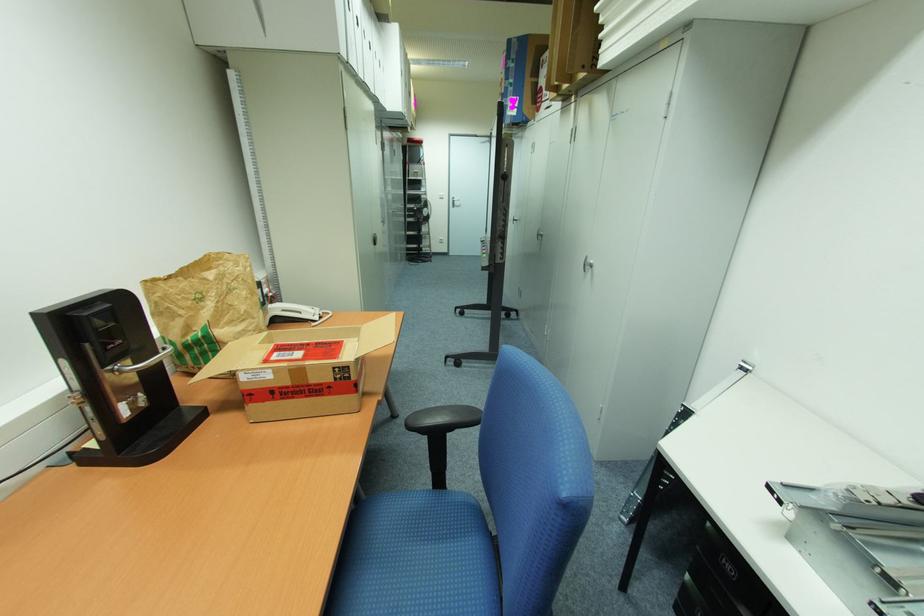
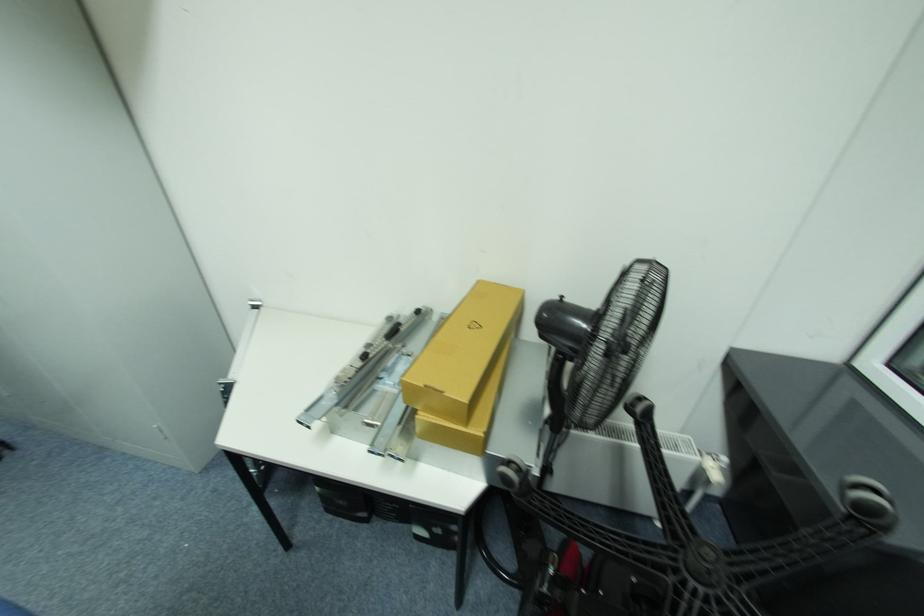
The images are taken continuously from a first-person perspective. In which direction is your viewpoint rotating?

The camera rotated toward right-down.